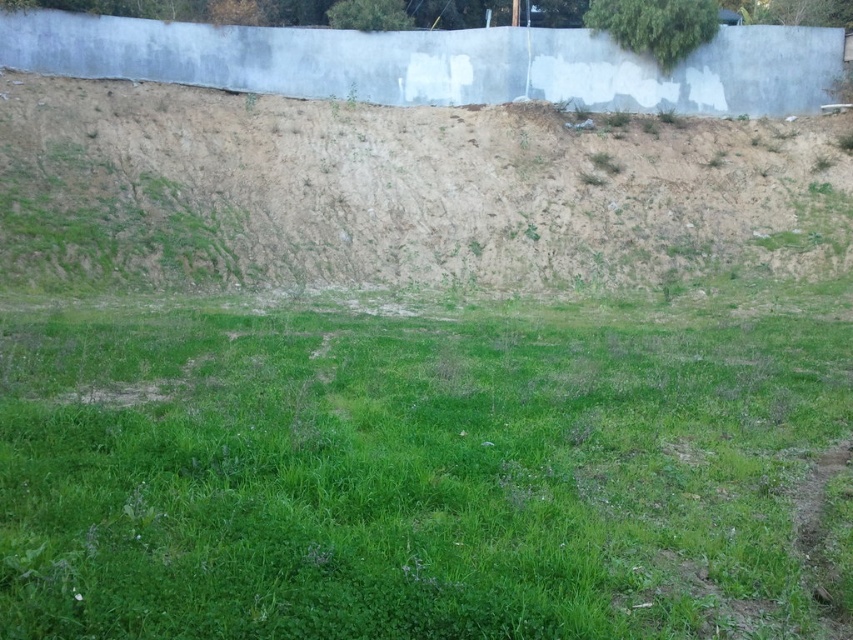
Where is `green grassy field at center`? green grassy field at center is located at coordinates (415, 470).

Identify the location of green grassy field at center. (415, 470).